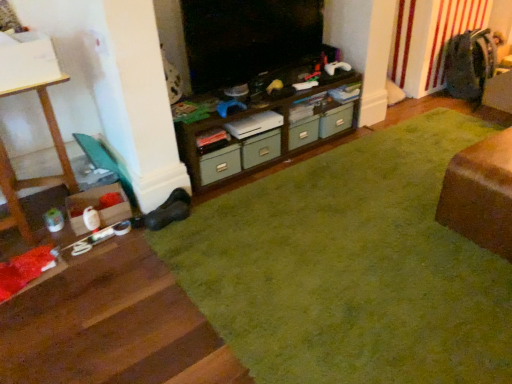
Question: From a real-world perspective, is green matte drawer at center, placed as the 1th drawer when sorted from right to left, above or below brown wood cabinet at center?

Choices:
 (A) below
 (B) above

Answer: (A)

Question: In terms of width, does green matte drawer at center, the first drawer viewed from the back, look wider or thinner when compared to brown wood cabinet at center?

Choices:
 (A) wide
 (B) thin

Answer: (B)

Question: Which of these objects is positioned farthest from the wooden table at left?

Choices:
 (A) green fabric drawer at center, the first drawer positioned from the front
 (B) green carpet at center
 (C) brown wood cabinet at center
 (D) brown wood table at lower right
 (E) green matte drawer at center, the first drawer viewed from the back

Answer: (D)

Question: Which of these objects is positioned closest to the brown wood table at lower right?

Choices:
 (A) green matte drawer at center, which is the 2th drawer in front-to-back order
 (B) green fabric drawer at center, the first drawer positioned from the front
 (C) brown wood cabinet at center
 (D) wooden table at left
 (E) green carpet at center

Answer: (E)